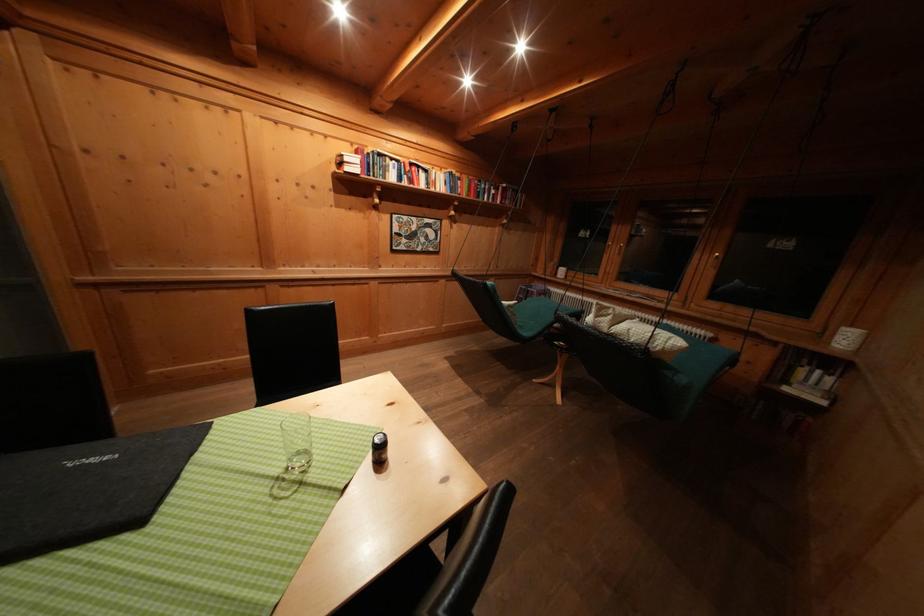
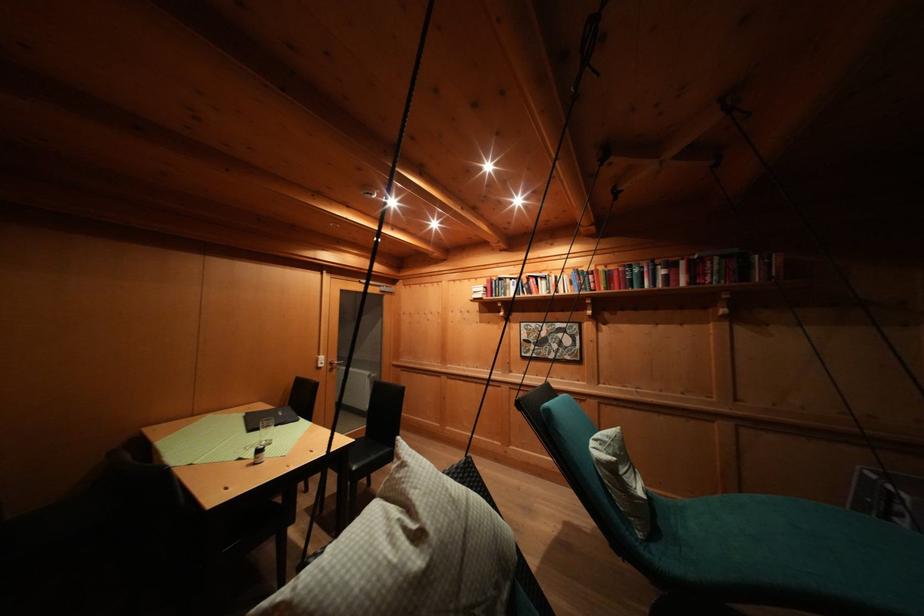
The point at (394, 164) is marked in the first image. Where is the corresponding point in the second image?

(514, 285)